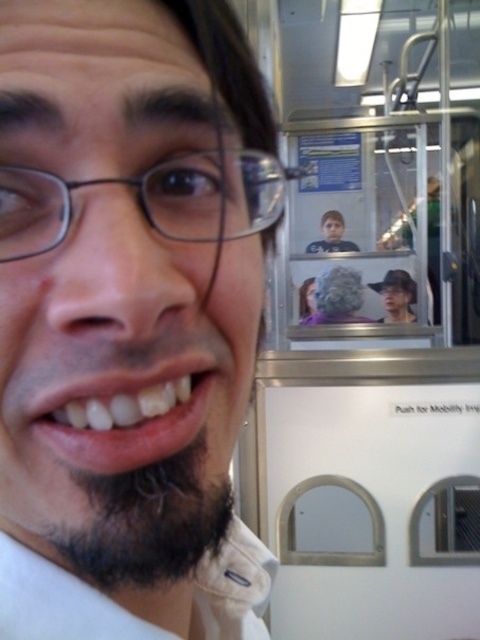
Question: Does white glossy teeth at lower center appear over dark brown fuzzy beard at lower left?

Choices:
 (A) no
 (B) yes

Answer: (B)

Question: Is white glossy teeth at lower center smaller than dark brown fuzzy beard at lower left?

Choices:
 (A) yes
 (B) no

Answer: (A)

Question: Which point is closer to the camera?

Choices:
 (A) (108, 371)
 (B) (235, 26)
 (C) (184, 236)

Answer: (A)

Question: Does white matte face at center have a greater width compared to matte black glasses at upper left?

Choices:
 (A) yes
 (B) no

Answer: (A)

Question: Based on their relative distances, which object is farther from the white matte face at center?

Choices:
 (A) white glossy teeth at lower center
 (B) matte black glasses at upper left
 (C) dark brown fuzzy beard at lower left

Answer: (B)

Question: Which is farther from the matte black glasses at upper left?

Choices:
 (A) white glossy teeth at lower center
 (B) dark brown fuzzy beard at lower left
 (C) white matte face at center

Answer: (B)